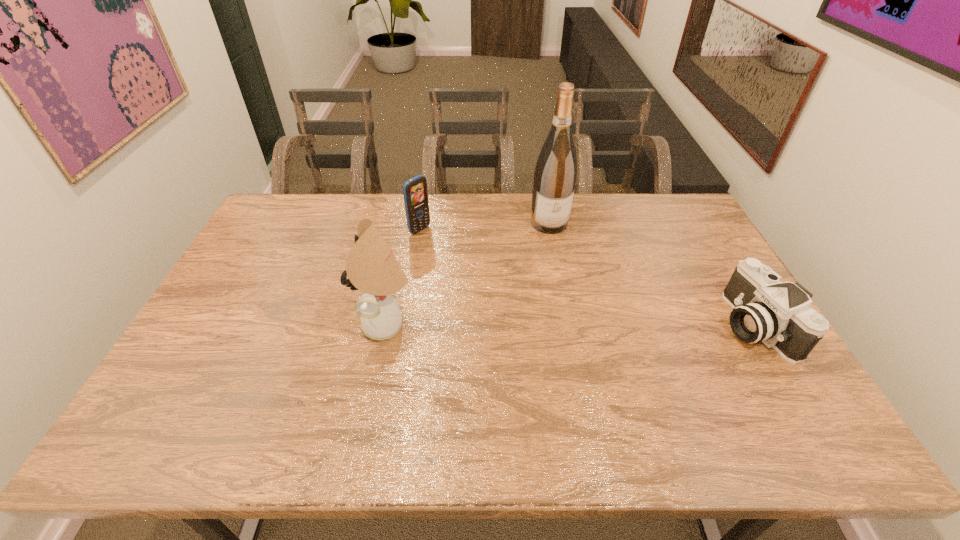
This screenshot has width=960, height=540. I want to click on vacant space on the desktop that is between the third shortest object and the rightmost object and is positioned on the screen of the cellular telephone, so click(563, 325).

Locate an element on the screen. Image resolution: width=960 pixels, height=540 pixels. vacant spot on the desktop that is between the third shortest object and the rightmost object and is positioned on the label of the wine bottle is located at coordinates (x=587, y=325).